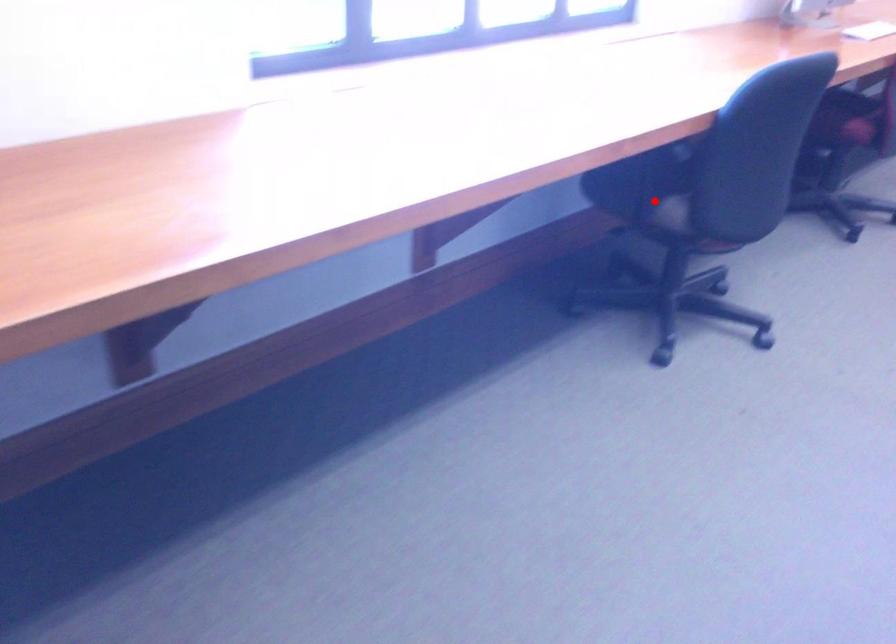
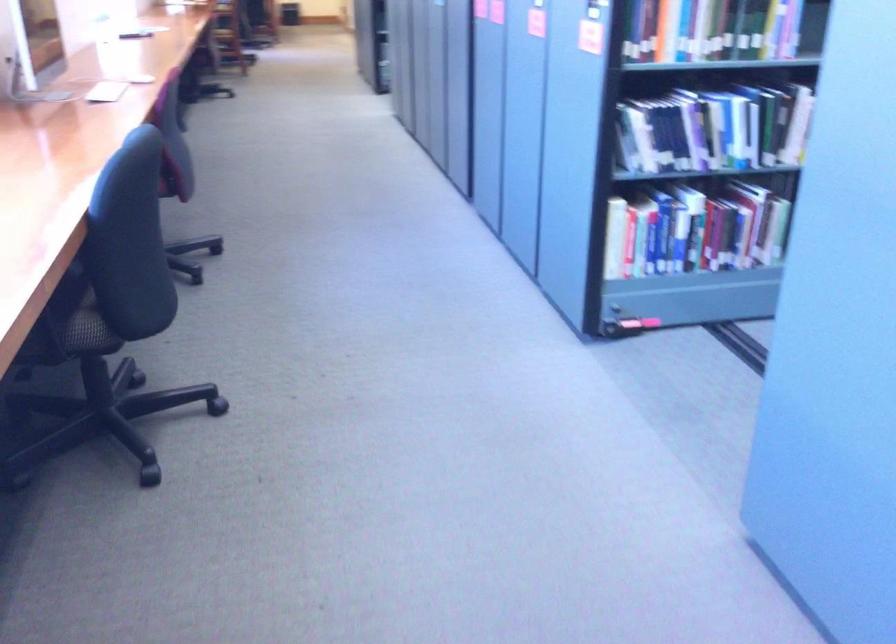
Question: A red point is marked in image1. In image2, is the corresponding 3D point closer to the camera or farther? Reply with the corresponding letter.

Choices:
 (A) The corresponding 3D point is closer.
 (B) The corresponding 3D point is farther.

Answer: (A)